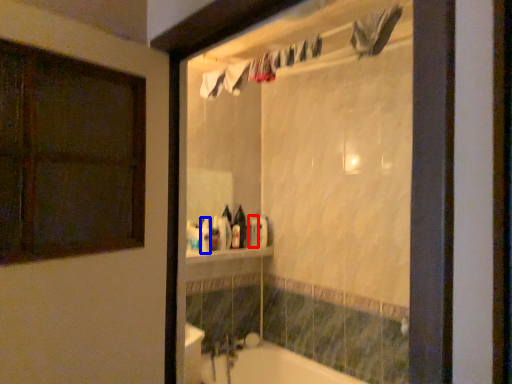
Question: Which point is further to the camera, toiletry (highlighted by a red box) or toiletry (highlighted by a blue box)?

Choices:
 (A) toiletry
 (B) toiletry

Answer: (A)